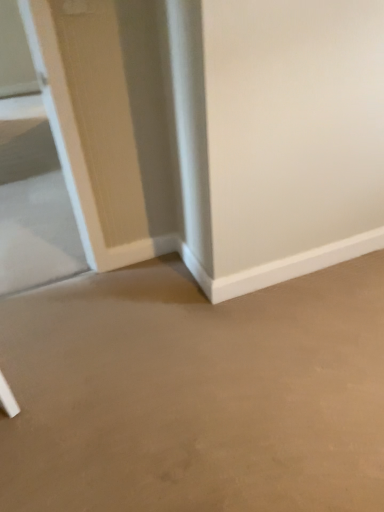
What do you see at coordinates (33, 197) in the screenshot? I see `clear glass door at left` at bounding box center [33, 197].

At what (x,y) coordinates should I click in order to perform the action: click on clear glass door at left. Please return your answer as a coordinate pair (x, y). This screenshot has height=512, width=384. Looking at the image, I should click on (33, 197).

This screenshot has width=384, height=512. I want to click on beige matte concrete at center, so pyautogui.click(x=195, y=393).

What do you see at coordinates (195, 393) in the screenshot?
I see `beige matte concrete at center` at bounding box center [195, 393].

Identify the location of clear glass door at left. 33,197.

Based on their positions, is clear glass door at left located to the left or right of beige matte concrete at center?

In the image, clear glass door at left appears on the left side of beige matte concrete at center.

Is clear glass door at left in front of or behind beige matte concrete at center in the image?

clear glass door at left is positioned farther from the viewer than beige matte concrete at center.

Considering the points (13, 291) and (114, 289), which point is in front, point (13, 291) or point (114, 289)?

The point (114, 289) is in front.

From the image's perspective, is clear glass door at left below beige matte concrete at center?

No, from the image's perspective, clear glass door at left is not below beige matte concrete at center.

In the scene shown: From a real-world perspective, does clear glass door at left stand above beige matte concrete at center?

No, from a real-world perspective, clear glass door at left is not on top of beige matte concrete at center.

Which object is thinner, clear glass door at left or beige matte concrete at center?

With smaller width is beige matte concrete at center.

From the picture: Does clear glass door at left have a greater height compared to beige matte concrete at center?

No, clear glass door at left is not taller than beige matte concrete at center.

Is clear glass door at left bigger or smaller than beige matte concrete at center?

Considering their sizes, clear glass door at left takes up less space than beige matte concrete at center.

Consider the image. Is clear glass door at left completely or partially outside of beige matte concrete at center?

Yes, clear glass door at left is outside of beige matte concrete at center.

Can you see clear glass door at left touching beige matte concrete at center?

No, clear glass door at left is not in contact with beige matte concrete at center.

Is clear glass door at left turned away from beige matte concrete at center?

clear glass door at left is not turned away from beige matte concrete at center.

What's the angular difference between clear glass door at left and beige matte concrete at center's facing directions?

There is a 180-degree angle between the facing directions of clear glass door at left and beige matte concrete at center.

The height and width of the screenshot is (512, 384). In the image, there is a beige matte concrete at center. What are the coordinates of `glass door above it (from the image's perspective)` in the screenshot? It's located at (33, 197).

Can you confirm if beige matte concrete at center is positioned to the left of clear glass door at left?

In fact, beige matte concrete at center is to the right of clear glass door at left.

Which is behind, beige matte concrete at center or clear glass door at left?

clear glass door at left is behind.

Which point is more forward, (195, 441) or (14, 273)?

The point (195, 441) is closer to the camera.

From the image's perspective, which is below, beige matte concrete at center or clear glass door at left?

beige matte concrete at center is shown below in the image.

From a real-world perspective, which is physically below, beige matte concrete at center or clear glass door at left?

clear glass door at left, from a real-world perspective.

Looking at their sizes, would you say beige matte concrete at center is wider or thinner than clear glass door at left?

Considering their sizes, beige matte concrete at center looks slimmer than clear glass door at left.

Who is taller, beige matte concrete at center or clear glass door at left?

beige matte concrete at center.

Considering the sizes of objects beige matte concrete at center and clear glass door at left in the image provided, who is smaller, beige matte concrete at center or clear glass door at left?

Smaller between the two is clear glass door at left.

Can we say beige matte concrete at center lies outside clear glass door at left?

Yes.

Is beige matte concrete at center not near clear glass door at left?

Yes.

Could you tell me if beige matte concrete at center is turned towards clear glass door at left?

Yes.

Image resolution: width=384 pixels, height=512 pixels. What are the coordinates of `concrete on the right of clear glass door at left` in the screenshot? It's located at (195, 393).

Where is `glass door below the beige matte concrete at center (from a real-world perspective)`? The image size is (384, 512). glass door below the beige matte concrete at center (from a real-world perspective) is located at coordinates (33, 197).

The height and width of the screenshot is (512, 384). I want to click on concrete above the clear glass door at left (from a real-world perspective), so click(195, 393).